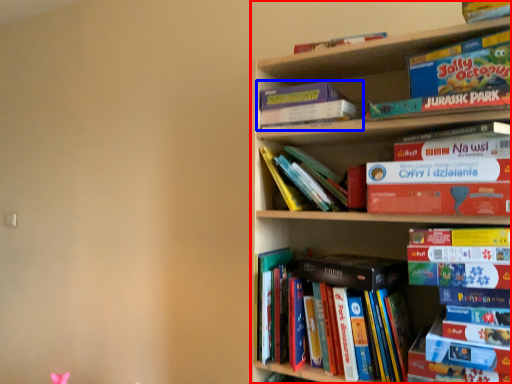
Question: Which object appears farthest to the camera in this image, bookcase (highlighted by a red box) or book (highlighted by a blue box)?

Choices:
 (A) bookcase
 (B) book

Answer: (B)